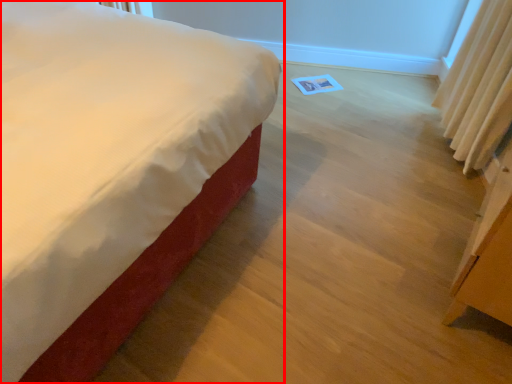
Question: From the image's perspective, where is bed (annotated by the red box) located relative to curtain?

Choices:
 (A) above
 (B) below

Answer: (B)